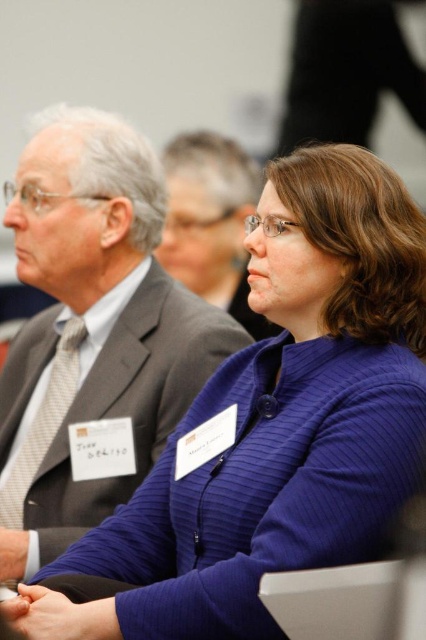
Question: Where is gray suit at center located in relation to matte gray suit at center in the image?

Choices:
 (A) below
 (B) above

Answer: (A)

Question: Which of the following is the farthest from the observer?

Choices:
 (A) coord(210,220)
 (B) coord(152,234)

Answer: (A)

Question: Does gray suit at center appear under matte gray suit at center?

Choices:
 (A) yes
 (B) no

Answer: (A)

Question: Which point appears closest to the camera in this image?

Choices:
 (A) (23, 458)
 (B) (276, 333)

Answer: (A)

Question: From the image, what is the correct spatial relationship of gray suit at center in relation to matte gray suit at center?

Choices:
 (A) above
 (B) below

Answer: (B)